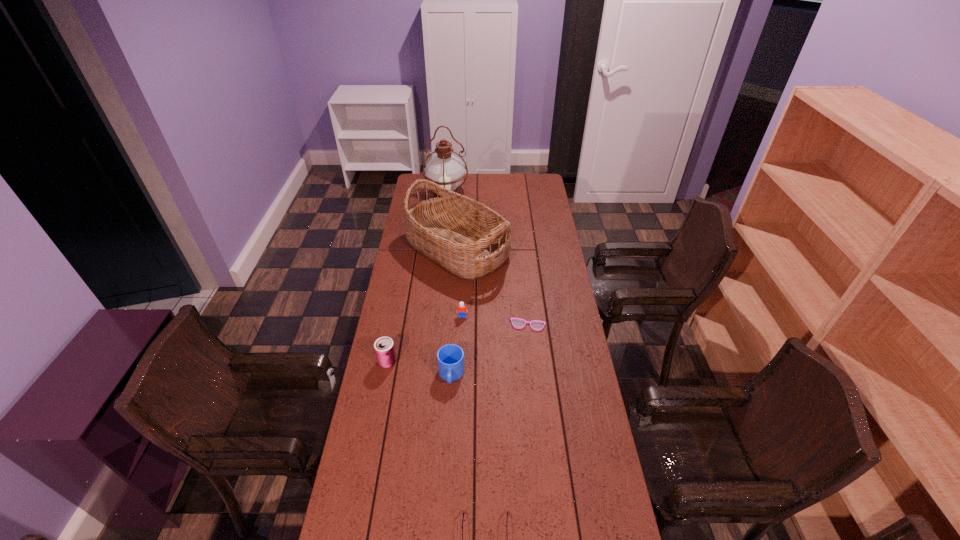
Locate an element on the screen. The width and height of the screenshot is (960, 540). vacant area that lies between the mug and the farthest object is located at coordinates (x=449, y=283).

At what (x,y) coordinates should I click in order to perform the action: click on vacant region between the mug and the taller spectacles. Please return your answer as a coordinate pair (x, y). Looking at the image, I should click on (490, 350).

Locate which object ranks second in proximity to the mug. Please provide its 2D coordinates. Your answer should be formatted as a tuple, i.e. [(x, y)], where the tuple contains the x and y coordinates of a point satisfying the conditions above.

[(462, 309)]

You are a GUI agent. You are given a task and a screenshot of the screen. Output one action in this format:
    pyautogui.click(x=<x>, y=<y>)
    Task: Click on the third closest object to the second farthest object
    
    Given the screenshot: What is the action you would take?
    pyautogui.click(x=536, y=325)

You are a GUI agent. You are given a task and a screenshot of the screen. Output one action in this format:
    pyautogui.click(x=<x>, y=<y>)
    Task: Click on the free space that satisfies the following two spatial constraints: 1. on the front side of the second tallest object; 2. on the right side of the tallest object
    
    Given the screenshot: What is the action you would take?
    pyautogui.click(x=441, y=249)

In order to click on vacant space that satisfies the following two spatial constraints: 1. on the back side of the tallest object; 2. on the left side of the can in this screenshot , I will do `click(420, 191)`.